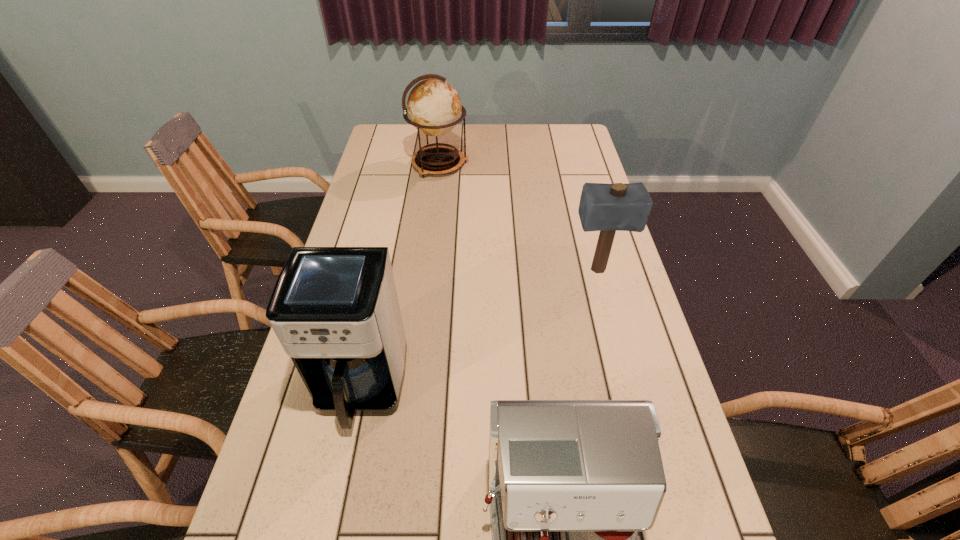
Locate an element on the screen. vacant area between the farther coffee maker and the globe is located at coordinates (400, 276).

Locate which object is the third closest to the farthest object. Please provide its 2D coordinates. Your answer should be formatted as a tuple, i.e. [(x, y)], where the tuple contains the x and y coordinates of a point satisfying the conditions above.

[(571, 482)]

In order to click on object identified as the third closest to the globe in this screenshot , I will do `click(571, 482)`.

You are a GUI agent. You are given a task and a screenshot of the screen. Output one action in this format:
    pyautogui.click(x=<x>, y=<y>)
    Task: Click on the vacant space that satisfies the following two spatial constraints: 1. at the center of the mallet; 2. on the right side of the farthest object
    This screenshot has height=540, width=960.
    Given the screenshot: What is the action you would take?
    pyautogui.click(x=427, y=270)

Locate an element on the screen. The width and height of the screenshot is (960, 540). vacant space that satisfies the following two spatial constraints: 1. at the center of the second farthest object; 2. on the left side of the globe is located at coordinates (427, 270).